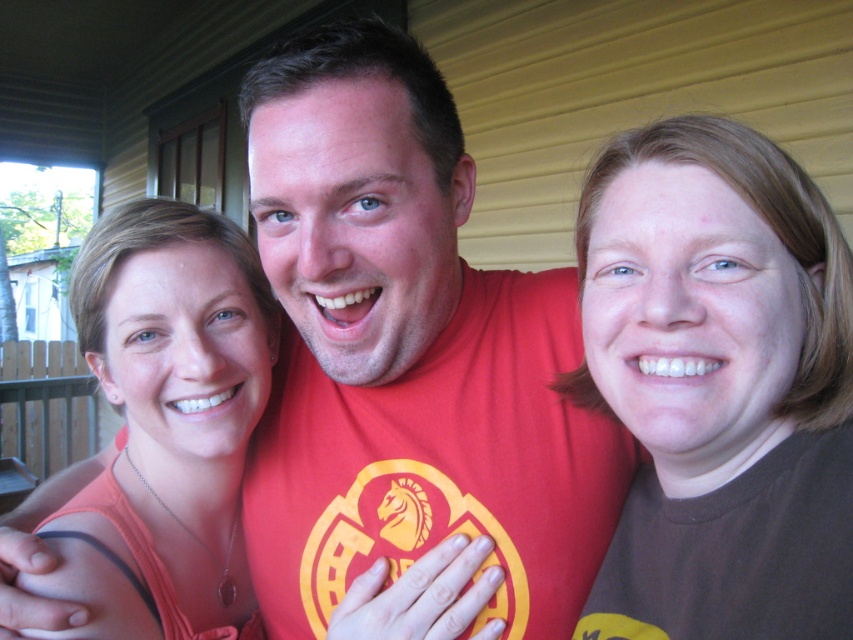
Question: Which point appears farthest from the camera in this image?

Choices:
 (A) (842, 420)
 (B) (119, 632)

Answer: (B)

Question: Is the position of brown matte hair at upper right more distant than that of matte orange tank top at center?

Choices:
 (A) no
 (B) yes

Answer: (A)

Question: Can you confirm if brown matte hair at upper right is wider than matte orange tank top at center?

Choices:
 (A) yes
 (B) no

Answer: (B)

Question: Among these objects, which one is farthest from the camera?

Choices:
 (A) brown matte hair at upper right
 (B) matte orange tank top at center

Answer: (B)

Question: Does brown matte hair at upper right come in front of matte orange tank top at center?

Choices:
 (A) no
 (B) yes

Answer: (B)